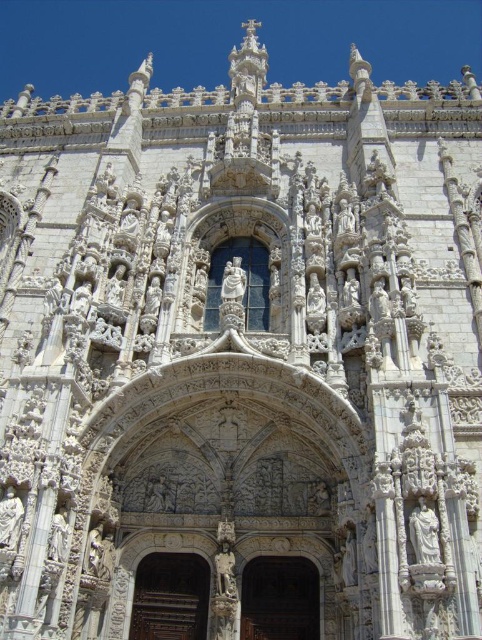
You are a delivery person with a package that requires a 5 meter wide space to maneuver. You are in front of the historic building and see the wooden door at center and the brown wood door at center. Can you turn around comfortably in the space between them?

The wooden door at center and brown wood door at center are 6.10 meters apart, which is wider than the required 5 meters, so yes, you can turn around comfortably between them.